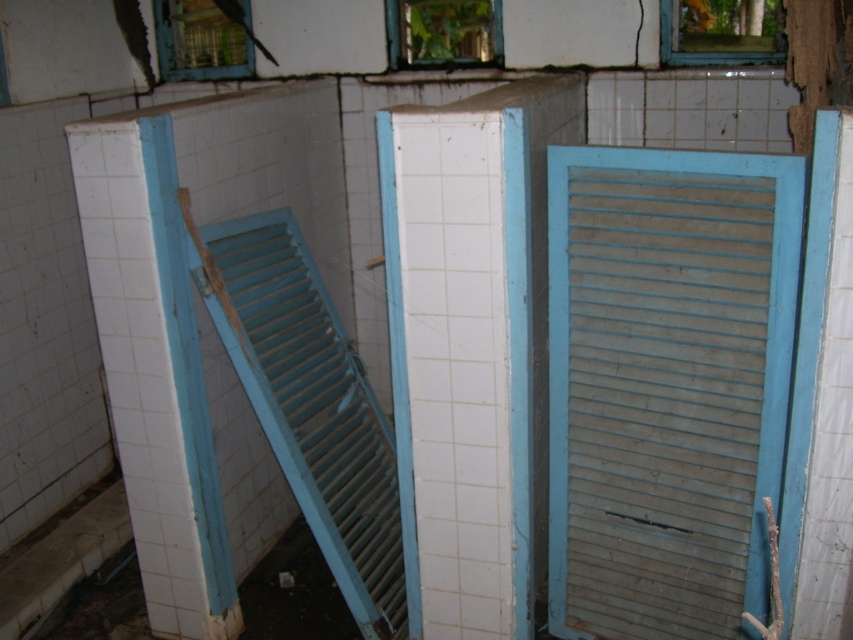
Who is more forward, (724, 340) or (456, 33)?

Point (724, 340) is in front.

Between wooden slats at center and transparent glass window at upper center, which one is positioned higher?

transparent glass window at upper center

Locate an element on the screen. This screenshot has width=853, height=640. wooden slats at center is located at coordinates (654, 397).

Where is `wooden slats at center`? The height and width of the screenshot is (640, 853). wooden slats at center is located at coordinates (654, 397).

Is wooden slats at center wider than clear glass window at upper center?

Indeed, wooden slats at center has a greater width compared to clear glass window at upper center.

Where is `wooden slats at center`? This screenshot has height=640, width=853. wooden slats at center is located at coordinates (654, 397).

Which is more to the left, blue painted wood shutter at left or clear glass window at upper center?

blue painted wood shutter at left is more to the left.

Between blue painted wood shutter at left and clear glass window at upper center, which one is positioned lower?

blue painted wood shutter at left is below.

The height and width of the screenshot is (640, 853). Identify the location of blue painted wood shutter at left. (309, 404).